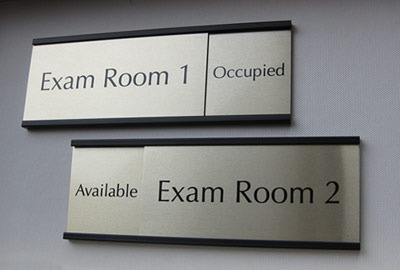
The height and width of the screenshot is (270, 400). What are the coordinates of `occupied sign` in the screenshot? It's located at (224, 75).